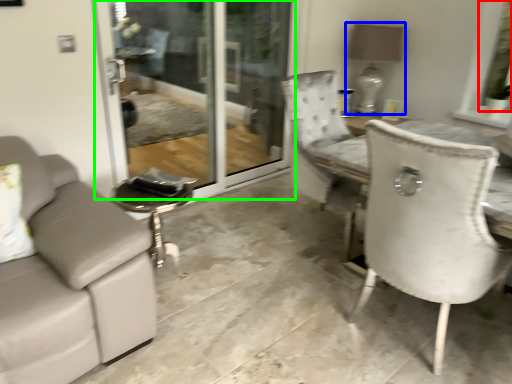
Question: Estimate the real-world distances between objects in this image. Which object is closer to window screen (highlighted by a red box), lamp (highlighted by a blue box) or screen door (highlighted by a green box)?

Choices:
 (A) lamp
 (B) screen door

Answer: (A)